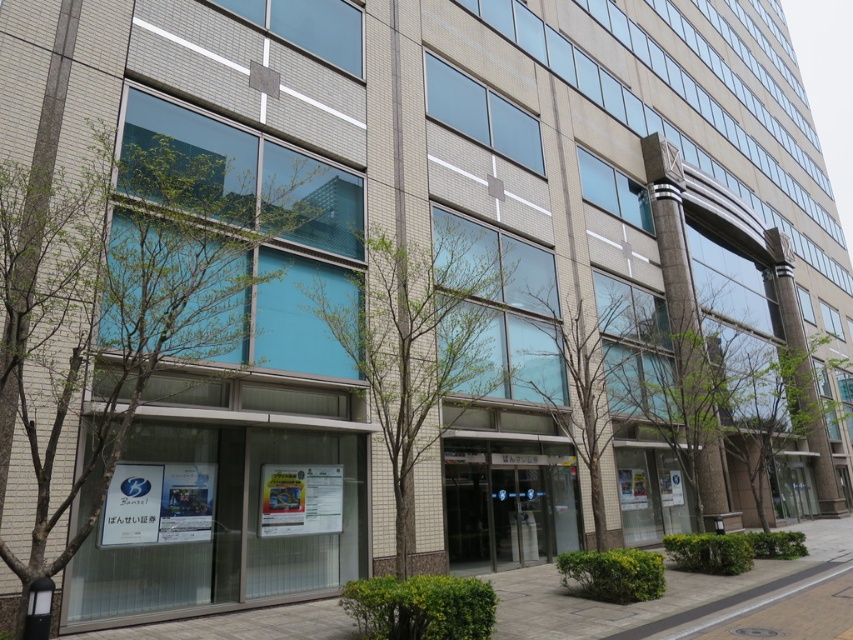
You are a delivery person approaching the entrance of the building. You need to place a heavy box on the ground. The box is too heavy to lift again, so you must choose between the smooth concrete pavement at lower center and the bare branches at center. Which surface is more suitable for placing the box?

The smooth concrete pavement at lower center is more suitable for placing the box because it is a solid surface, whereas the bare branches at center are likely part of a tree and cannot support heavy items.

Consider the image. You are a delivery person trying to park your 2.5 meter wide delivery van. You see the smooth concrete pavement at lower center and the bare branches at center. Which area can accommodate your van?

The smooth concrete pavement at lower center has a width surpassing that of the bare branches at center. Since the pavement is wider, it can accommodate the 2.5 meter wide delivery van.

You are standing at the entrance of the modern multi story building. You see a point at coordinate (697, 600). What is the surface type of this point?

The point at coordinate (697, 600) is on smooth concrete pavement at lower center.